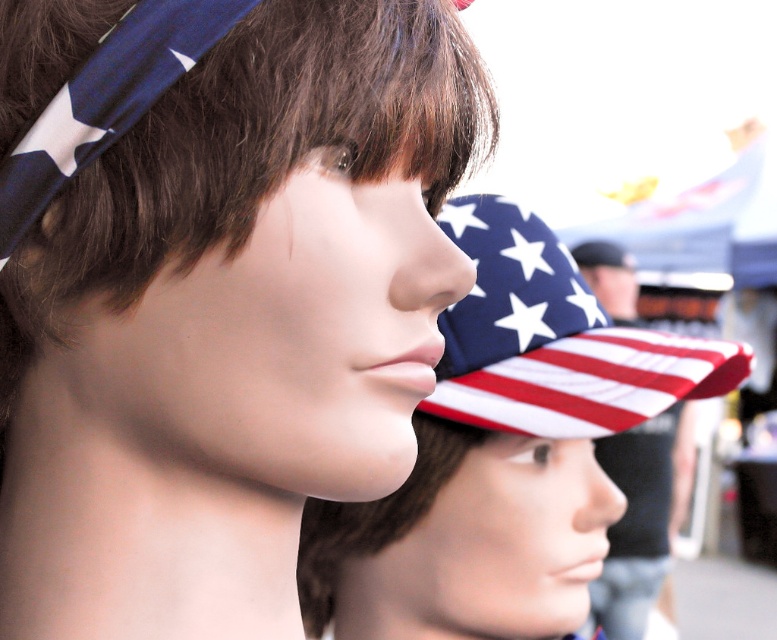
You are a store employee arranging mannequin heads for a display. You have two items to place on the mannequins. The first is an american flag fabric baseball cap at center and the second is an american flag hat at center. According to the scene, which item is currently blocking the view of the other?

The american flag fabric baseball cap at center is in front of the american flag hat at center, so it is blocking the view of the latter.

You are a store manager arranging a display. You have a matte plastic mannequin head at center and an american flag hat at center. Which object is smaller in size?

The matte plastic mannequin head at center is smaller in size compared to the american flag hat at center.